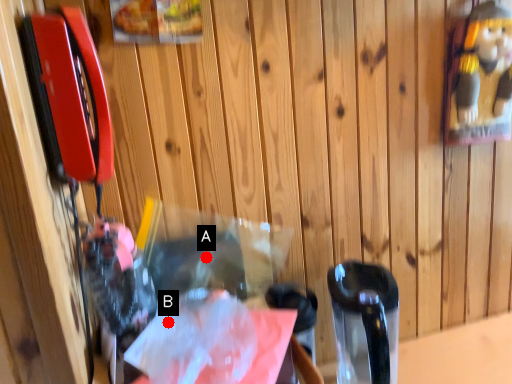
Question: Two points are circled on the image, labeled by A and B beside each circle. Which point is farther from the camera taking this photo?

Choices:
 (A) A is further
 (B) B is further

Answer: (A)